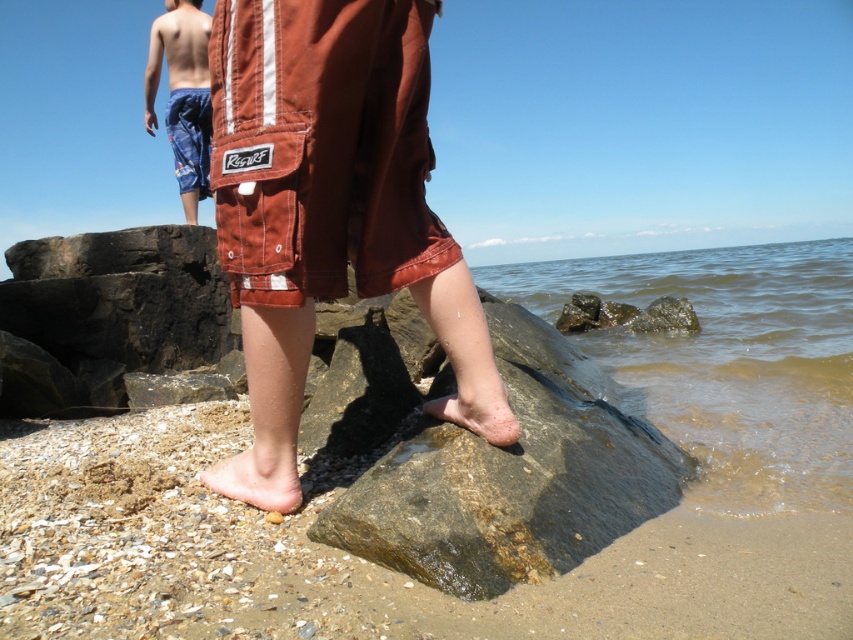
You are a photographer standing at the shoreline. You want to capture a photo of the brown sandy beach at lower left without including the person in red cargo shorts. Can you step back enough to do this?

The brown sandy beach at lower left is 3.77 feet away from the camera. Since the photographer is already at the shoreline, stepping back might not be possible without moving away from the current position. However, adjusting the camera angle or zoom could help exclude the person in red cargo shorts while keeping the beach in frame.

You are a photographer trying to capture the pale skin barefoot at lower center. Based on the coordinates provided in the description, where should you position your camera to ensure the foot is in the frame?

The pale skin barefoot at lower center is located at point (x=259, y=474), so you should position your camera to focus on that coordinate to include the foot in the frame.